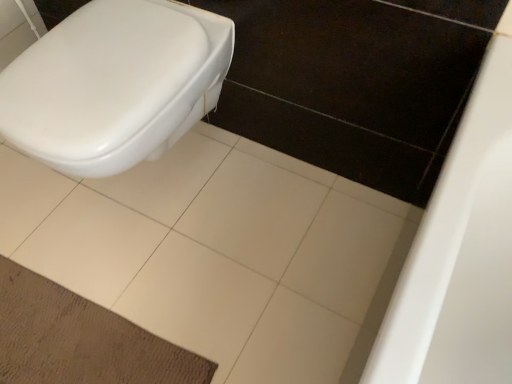
Locate an element on the screen. This screenshot has width=512, height=384. white glossy toilet at left is located at coordinates (115, 84).

Describe the element at coordinates (220, 253) in the screenshot. I see `white ceramic tile at center` at that location.

At what (x,y) coordinates should I click in order to perform the action: click on white glossy toilet at left. Please return your answer as a coordinate pair (x, y). The image size is (512, 384). Looking at the image, I should click on (115, 84).

Does brown textured mat at lower left have a lesser height compared to white glossy toilet at left?

Indeed, brown textured mat at lower left has a lesser height compared to white glossy toilet at left.

From a real-world perspective, is brown textured mat at lower left on top of white glossy toilet at left?

No, from a real-world perspective, brown textured mat at lower left is not over white glossy toilet at left

Considering the positions of objects brown textured mat at lower left and white glossy toilet at left in the image provided, who is more to the left, brown textured mat at lower left or white glossy toilet at left?

From the viewer's perspective, brown textured mat at lower left appears more on the left side.

Is white glossy toilet at left inside brown textured mat at lower left?

No, white glossy toilet at left is not inside brown textured mat at lower left.

Considering the sizes of objects white ceramic tile at center and brown textured mat at lower left in the image provided, who is bigger, white ceramic tile at center or brown textured mat at lower left?

white ceramic tile at center.

Is white ceramic tile at center at the right side of brown textured mat at lower left?

Yes, white ceramic tile at center is to the right of brown textured mat at lower left.

From the image's perspective, which object appears higher, white ceramic tile at center or brown textured mat at lower left?

white ceramic tile at center, from the image's perspective.

Can you confirm if brown textured mat at lower left is positioned to the right of white ceramic tile at center?

No, brown textured mat at lower left is not to the right of white ceramic tile at center.

From the image's perspective, is brown textured mat at lower left located above white ceramic tile at center?

No, from the image's perspective, brown textured mat at lower left is not above white ceramic tile at center.

Which object is wider, brown textured mat at lower left or white ceramic tile at center?

white ceramic tile at center is wider.

What's the angular difference between brown textured mat at lower left and white ceramic tile at center's facing directions?

They differ by 3.77 degrees in their facing directions.

Is white ceramic tile at center to the right of white glossy toilet at left from the viewer's perspective?

In fact, white ceramic tile at center is to the left of white glossy toilet at left.

From a real-world perspective, is white ceramic tile at center physically below white glossy toilet at left?

Yes, from a real-world perspective, white ceramic tile at center is beneath white glossy toilet at left.

Which of these two, white ceramic tile at center or white glossy toilet at left, stands shorter?

white ceramic tile at center.

Is white ceramic tile at center closer to the viewer compared to white glossy toilet at left?

No, the depth of white ceramic tile at center is greater than that of white glossy toilet at left.

Between white glossy toilet at left and brown textured mat at lower left, which one has larger width?

brown textured mat at lower left.

The width and height of the screenshot is (512, 384). I want to click on toilet that is above the brown textured mat at lower left (from a real-world perspective), so click(x=115, y=84).

From the image's perspective, which object appears higher, white glossy toilet at left or brown textured mat at lower left?

From the image's view, white glossy toilet at left is above.

Is point (187, 52) behind point (10, 330)?

No.

From a real-world perspective, is white glossy toilet at left physically located above or below white ceramic tile at center?

In terms of real-world spatial position, white glossy toilet at left is above white ceramic tile at center.

From the picture: Is white glossy toilet at left wider than white ceramic tile at center?

No.

Locate an element on the screen. The width and height of the screenshot is (512, 384). ceramic tile behind the white glossy toilet at left is located at coordinates (220, 253).

Is white glossy toilet at left surrounding white ceramic tile at center?

Actually, white ceramic tile at center is outside white glossy toilet at left.

The image size is (512, 384). In order to click on toilet above the brown textured mat at lower left (from a real-world perspective) in this screenshot , I will do `click(115, 84)`.

Identify the location of doormat that is behind the white ceramic tile at center. This screenshot has height=384, width=512. (80, 340).

Looking at the image, which one is located closer to white ceramic tile at center, brown textured mat at lower left or white glossy toilet at left?

Among the two, brown textured mat at lower left is located nearer to white ceramic tile at center.

Estimate the real-world distances between objects in this image. Which object is further from white glossy toilet at left, white ceramic tile at center or brown textured mat at lower left?

brown textured mat at lower left lies further to white glossy toilet at left than the other object.

When comparing their distances from white ceramic tile at center, does white glossy toilet at left or brown textured mat at lower left seem further?

Among the two, white glossy toilet at left is located further to white ceramic tile at center.

From the picture: Considering their positions, is brown textured mat at lower left positioned closer to white glossy toilet at left than white ceramic tile at center?

The object closer to white glossy toilet at left is white ceramic tile at center.

Based on their spatial positions, is white ceramic tile at center or white glossy toilet at left further from brown textured mat at lower left?

The object further to brown textured mat at lower left is white glossy toilet at left.

In the scene shown: From the image, which object appears to be farther from brown textured mat at lower left, white glossy toilet at left or white ceramic tile at center?

white glossy toilet at left is further to brown textured mat at lower left.

Where is `ceramic tile that lies between white glossy toilet at left and brown textured mat at lower left from top to bottom`? This screenshot has height=384, width=512. ceramic tile that lies between white glossy toilet at left and brown textured mat at lower left from top to bottom is located at coordinates (220, 253).